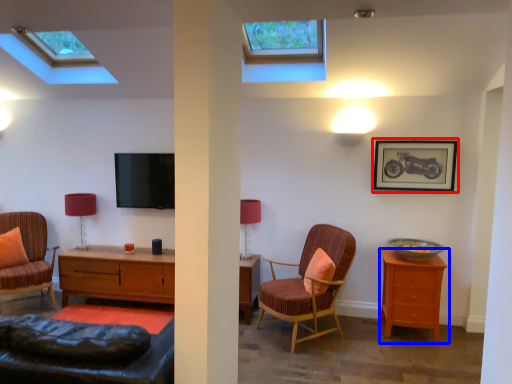
Question: Among these objects, which one is farthest to the camera, picture frame (highlighted by a red box) or nightstand (highlighted by a blue box)?

Choices:
 (A) picture frame
 (B) nightstand

Answer: (A)